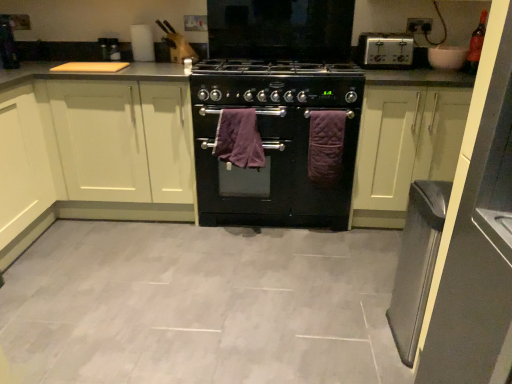
Question: Is white matte cabinet at left, the 2th cabinetry viewed from the right, in front of black matte gas stove at center?

Choices:
 (A) yes
 (B) no

Answer: (B)

Question: From a real-world perspective, is white matte cabinet at left, the 2th cabinetry viewed from the right, positioned over black matte gas stove at center based on gravity?

Choices:
 (A) yes
 (B) no

Answer: (B)

Question: Can you confirm if white matte cabinet at left, marked as the 1th cabinetry in a left-to-right arrangement, is taller than black matte gas stove at center?

Choices:
 (A) yes
 (B) no

Answer: (A)

Question: From a real-world perspective, is white matte cabinet at left, marked as the 1th cabinetry in a left-to-right arrangement, below black matte gas stove at center?

Choices:
 (A) yes
 (B) no

Answer: (A)

Question: Does white matte cabinet at left, the 2th cabinetry viewed from the right, have a lesser height compared to black matte gas stove at center?

Choices:
 (A) no
 (B) yes

Answer: (A)

Question: Considering the relative sizes of white matte cabinet at left, marked as the 1th cabinetry in a left-to-right arrangement, and black matte gas stove at center in the image provided, is white matte cabinet at left, marked as the 1th cabinetry in a left-to-right arrangement, thinner than black matte gas stove at center?

Choices:
 (A) no
 (B) yes

Answer: (A)

Question: Is white matte cabinet at left, the 2th cabinetry viewed from the right, aimed at black matte oven at center?

Choices:
 (A) no
 (B) yes

Answer: (A)

Question: Can you confirm if white matte cabinet at left, the 2th cabinetry viewed from the right, is thinner than black matte oven at center?

Choices:
 (A) yes
 (B) no

Answer: (A)

Question: From the image's perspective, is white matte cabinet at left, the 2th cabinetry viewed from the right, beneath black matte oven at center?

Choices:
 (A) yes
 (B) no

Answer: (B)

Question: From a real-world perspective, is white matte cabinet at left, the 2th cabinetry viewed from the right, physically below black matte oven at center?

Choices:
 (A) no
 (B) yes

Answer: (A)

Question: Is white matte cabinet at left, marked as the 1th cabinetry in a left-to-right arrangement, to the left of black matte oven at center from the viewer's perspective?

Choices:
 (A) no
 (B) yes

Answer: (B)

Question: Is white matte cabinet at left, marked as the 1th cabinetry in a left-to-right arrangement, in contact with black matte oven at center?

Choices:
 (A) no
 (B) yes

Answer: (A)

Question: Would you say black matte oven at center contains silver metallic toaster at upper right?

Choices:
 (A) yes
 (B) no

Answer: (B)